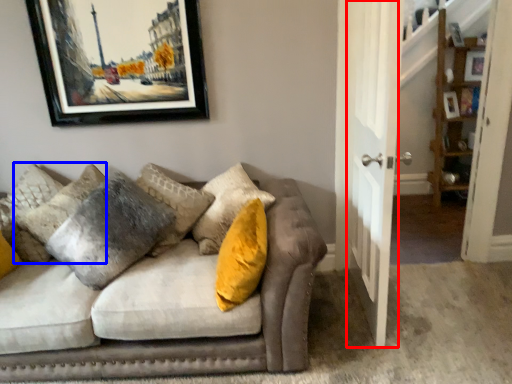
Question: Which of the following is the closest to the observer, door (highlighted by a red box) or pillow (highlighted by a blue box)?

Choices:
 (A) door
 (B) pillow

Answer: (A)